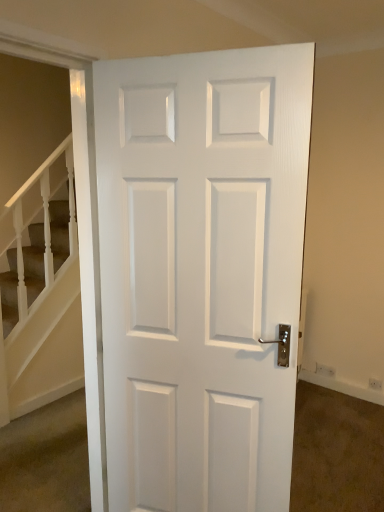
Question: Can you see white glossy door at center touching white textured stairs at left?

Choices:
 (A) yes
 (B) no

Answer: (B)

Question: Is white glossy door at center at the left side of white textured stairs at left?

Choices:
 (A) no
 (B) yes

Answer: (A)

Question: From a real-world perspective, is white glossy door at center positioned over white textured stairs at left based on gravity?

Choices:
 (A) no
 (B) yes

Answer: (B)

Question: Can you confirm if white glossy door at center is bigger than white textured stairs at left?

Choices:
 (A) yes
 (B) no

Answer: (A)

Question: Is white glossy door at center oriented towards white textured stairs at left?

Choices:
 (A) no
 (B) yes

Answer: (A)

Question: Does white glossy door at center have a greater height compared to white textured stairs at left?

Choices:
 (A) no
 (B) yes

Answer: (B)

Question: Does white textured stairs at left appear on the left side of white glossy door at center?

Choices:
 (A) no
 (B) yes

Answer: (B)

Question: Can you confirm if white textured stairs at left is bigger than white glossy door at center?

Choices:
 (A) no
 (B) yes

Answer: (A)

Question: From the image's perspective, is white textured stairs at left below white glossy door at center?

Choices:
 (A) no
 (B) yes

Answer: (B)

Question: Is white textured stairs at left touching white glossy door at center?

Choices:
 (A) no
 (B) yes

Answer: (A)

Question: Is white textured stairs at left wider than white glossy door at center?

Choices:
 (A) yes
 (B) no

Answer: (B)

Question: From the image's perspective, does white textured stairs at left appear higher than white glossy door at center?

Choices:
 (A) yes
 (B) no

Answer: (B)

Question: Is white textured stairs at left in front of or behind white glossy door at center in the image?

Choices:
 (A) front
 (B) behind

Answer: (B)